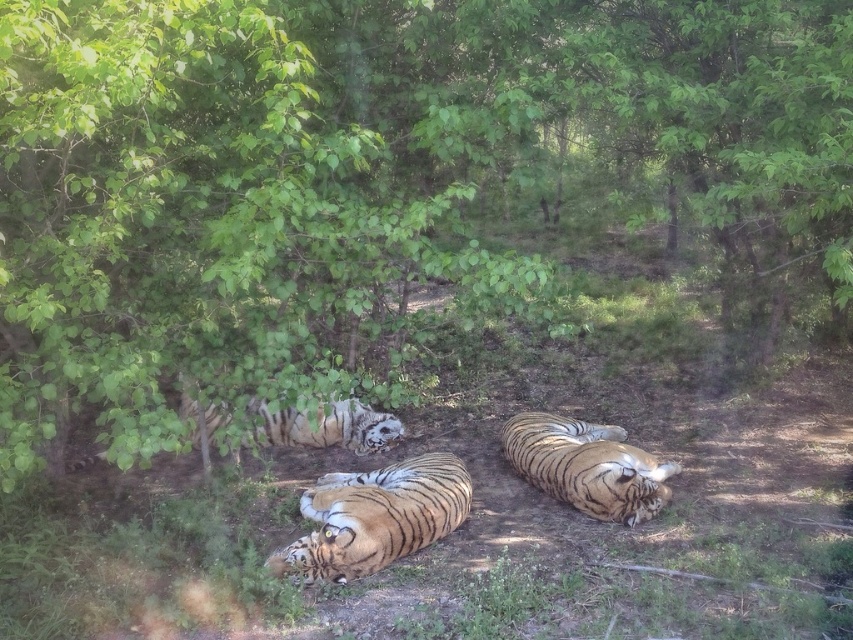
Based on the photo, you are a wildlife photographer aiming to capture a photo of both the orange striped tiger at center and the white fur tiger at center. Since you want to ensure both tigers are clearly visible in your shot, which tiger should you focus on first to account for their sizes?

The orange striped tiger at center is taller than the white fur tiger at center, so you should focus on the orange striped tiger at center first to ensure proper focus and visibility.

You are a wildlife photographer aiming to capture a photo of the orange striped tiger at center and the orange striped tiger at lower right. If you want to focus on the tiger that is closer to you, which one should you choose?

The orange striped tiger at center is closer to you since it is in front of the orange striped tiger at lower right.

You are a wildlife photographer trying to capture a photo of the orange striped tiger at center and the orange striped tiger at lower right. Based on their heights, which tiger should you focus on to ensure your camera can capture the entire body in the frame without cropping?

The orange striped tiger at center is not as tall as the orange striped tiger at lower right. Therefore, you should focus on the orange striped tiger at lower right since it is taller and requires more space in the frame to avoid cropping.